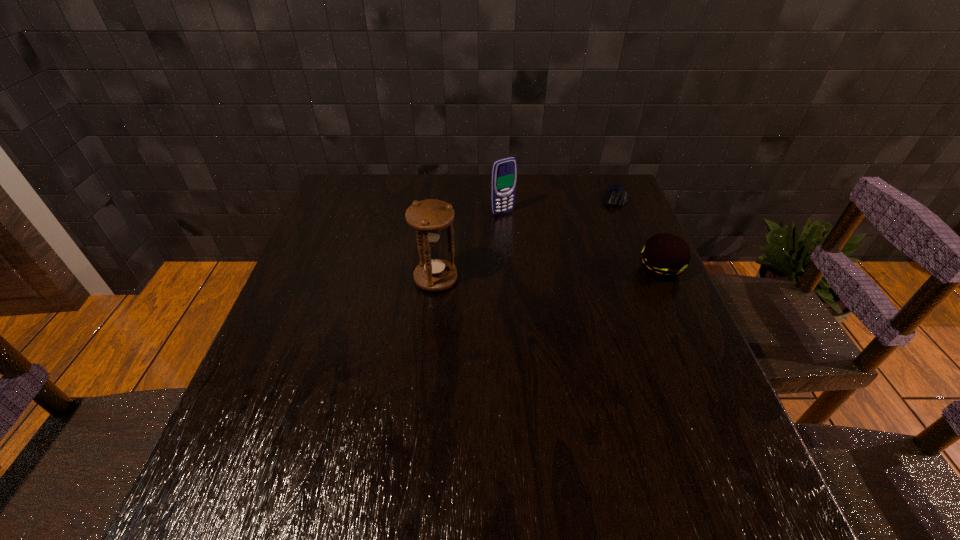
Where is `free space on the desktop that is between the leftmost object and the third tallest object and is positioned on the front-facing side of the second farthest object`? The width and height of the screenshot is (960, 540). free space on the desktop that is between the leftmost object and the third tallest object and is positioned on the front-facing side of the second farthest object is located at coordinates (x=559, y=274).

The image size is (960, 540). Identify the location of free space on the desktop that is between the tallest object and the patty and is positioned on the button side of the farthest object. (579, 273).